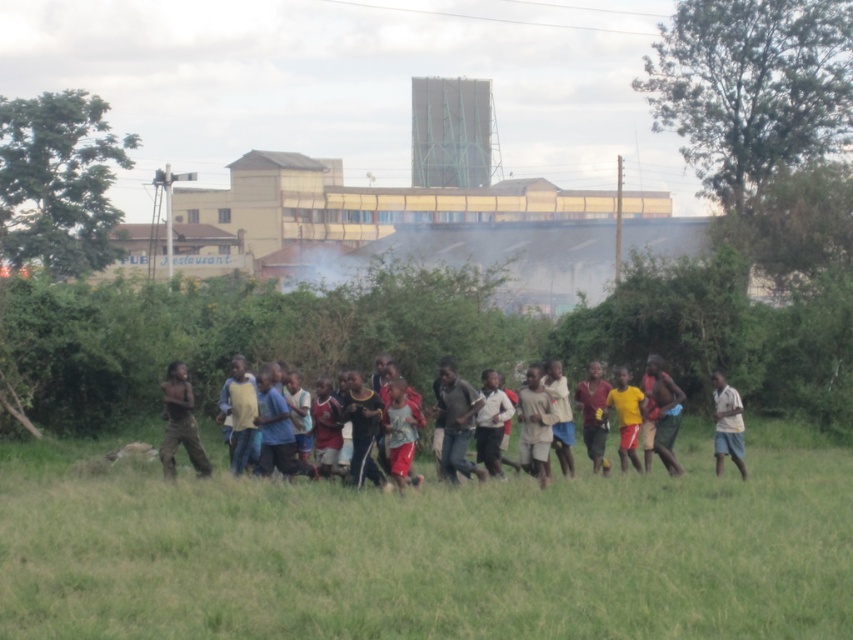
Between green grass at center and white cotton shirt at right, which one appears on the left side from the viewer's perspective?

Positioned to the left is green grass at center.

In the scene shown: Can you confirm if green grass at center is shorter than white cotton shirt at right?

Indeed, green grass at center has a lesser height compared to white cotton shirt at right.

Between point (402, 616) and point (711, 376), which one is positioned behind?

Point (711, 376)

Locate an element on the screen. The width and height of the screenshot is (853, 640). green grass at center is located at coordinates (431, 552).

Measure the distance between point (764, 472) and camera.

The distance of point (764, 472) from camera is 18.73 meters.

Is point (753, 570) positioned behind point (659, 371)?

That is False.

This screenshot has height=640, width=853. What do you see at coordinates (431, 552) in the screenshot?
I see `green grass at center` at bounding box center [431, 552].

The height and width of the screenshot is (640, 853). Identify the location of green grass at center. (431, 552).

Can you confirm if multicolored clothing at center is taller than dark brown pants at left?

No, multicolored clothing at center is not taller than dark brown pants at left.

Describe the element at coordinates (654, 413) in the screenshot. I see `multicolored clothing at center` at that location.

Where is `multicolored clothing at center`? multicolored clothing at center is located at coordinates (654, 413).